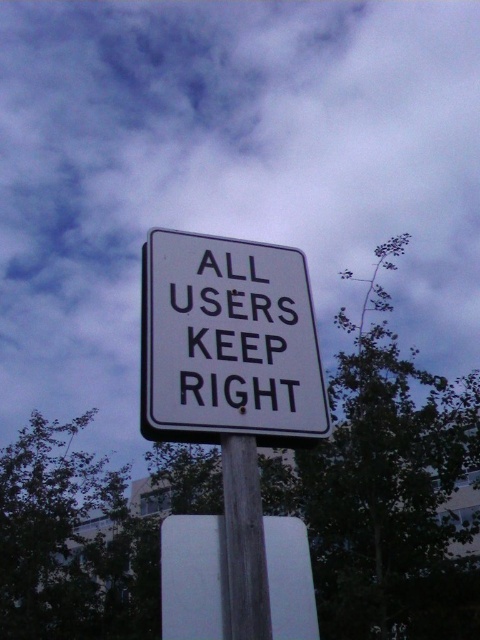
You are a pedestrian navigating a path near the traffic sign. You see two points marked on the ground. The first point is at point (187,609) and the second is at point (222,435). If you are facing the direction of the traffic sign, which point is closer to you?

Point (187,609) is in front of point (222,435), so it is closer to you when facing the traffic sign.

You are standing in front of the traffic sign described in the scene. There is a specific point labeled as point [231,323] on the sign. What color is the material or texture at that point?

The material or texture at point [231,323] is black, as the point corresponds to black materialtexturetext at center.